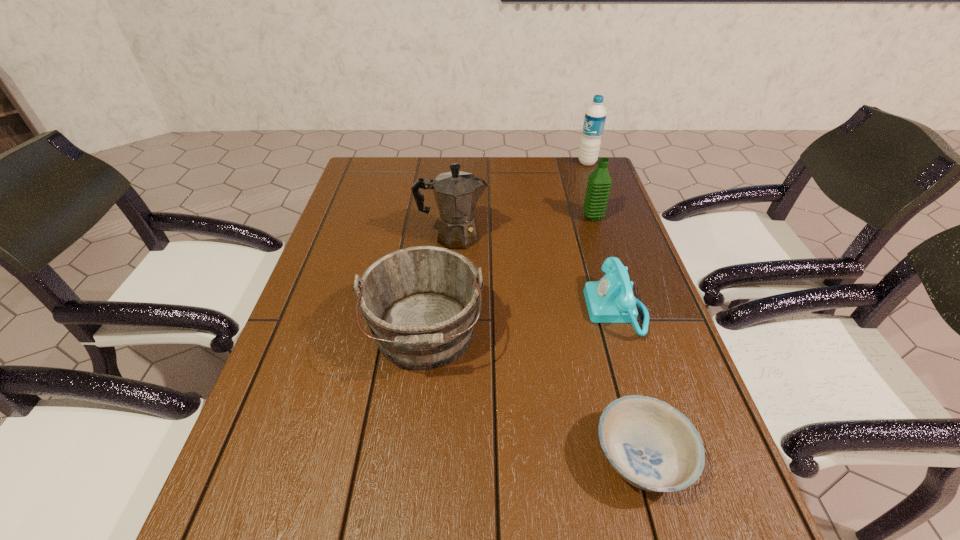
Image resolution: width=960 pixels, height=540 pixels. In order to click on vacant position in the image that satisfies the following two spatial constraints: 1. on the back side of the nearest object; 2. on the pouring side of the coffeepot in this screenshot , I will do `click(581, 237)`.

This screenshot has width=960, height=540. Find the location of `vacant region that satisfies the following two spatial constraints: 1. on the front side of the second farthest object; 2. on the pouring side of the fourth nearest object`. vacant region that satisfies the following two spatial constraints: 1. on the front side of the second farthest object; 2. on the pouring side of the fourth nearest object is located at coordinates (599, 237).

At what (x,y) coordinates should I click in order to perform the action: click on vacant position in the image that satisfies the following two spatial constraints: 1. on the back side of the shorter water bottle; 2. on the right side of the nearest object. Please return your answer as a coordinate pair (x, y). The image size is (960, 540). Looking at the image, I should click on (576, 217).